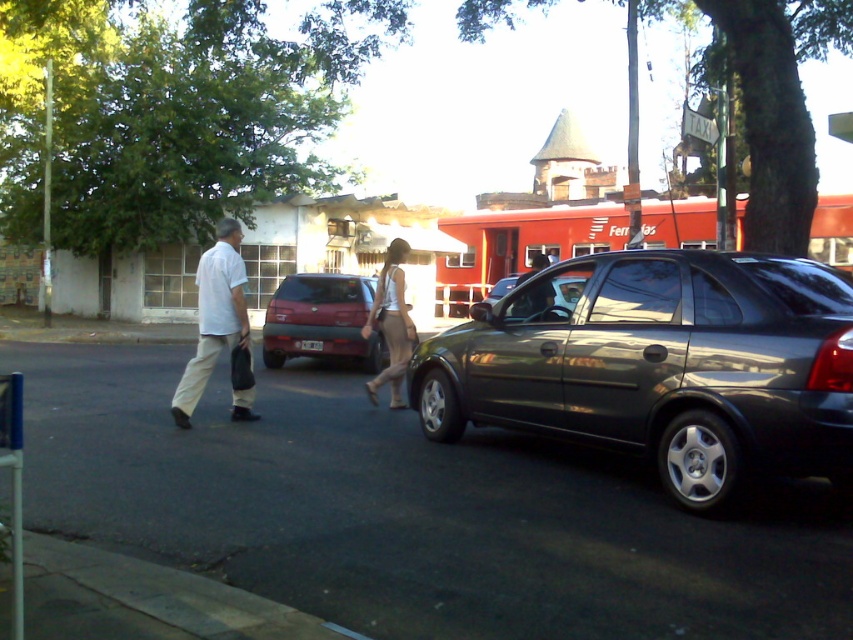
Question: Is dark asphalt pavement at center bigger than matte white tank top at center?

Choices:
 (A) no
 (B) yes

Answer: (B)

Question: Where is dark asphalt pavement at center located in relation to satin black sedan at center in the image?

Choices:
 (A) above
 (B) below

Answer: (B)

Question: Which point is farther to the camera?

Choices:
 (A) (554, 288)
 (B) (202, 259)

Answer: (B)

Question: Is white matte shirt at center positioned behind satin black sedan at center?

Choices:
 (A) yes
 (B) no

Answer: (A)

Question: Which object is farther from the camera taking this photo?

Choices:
 (A) dark asphalt pavement at center
 (B) white matte shirt at center

Answer: (B)

Question: Among these points, which one is farthest from the camera?

Choices:
 (A) (566, 285)
 (B) (395, 323)

Answer: (B)